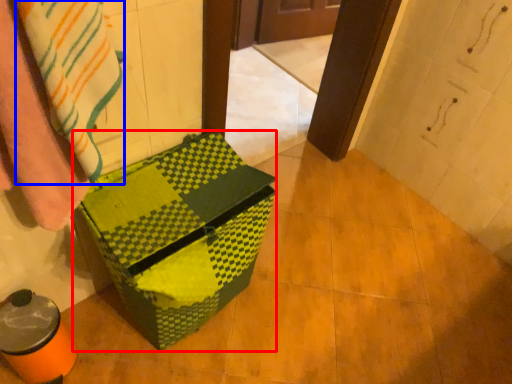
Question: Which object is further to the camera taking this photo, cardboard box (highlighted by a red box) or blanket (highlighted by a blue box)?

Choices:
 (A) cardboard box
 (B) blanket

Answer: (A)